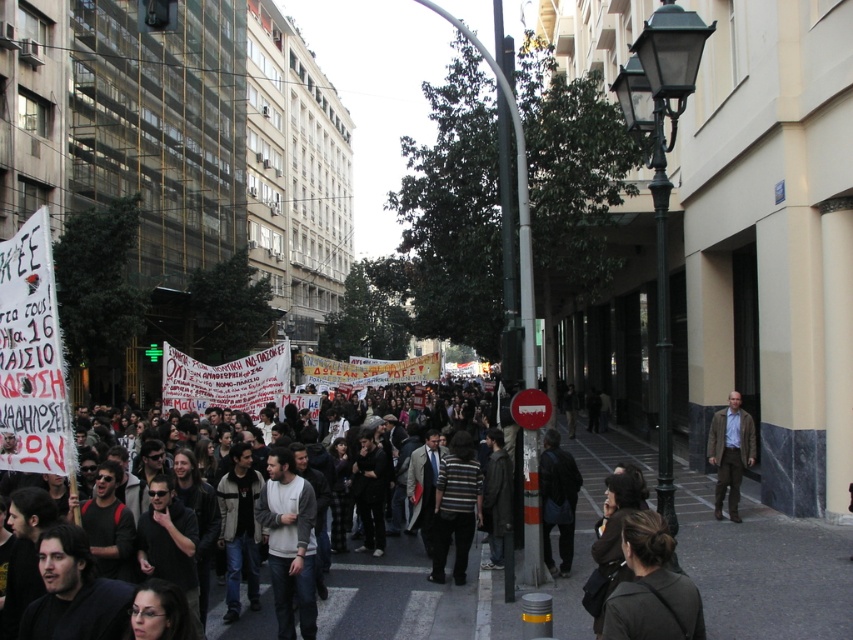
Is dark gray clothing at center taller than gray cotton shirt at center?

Incorrect, dark gray clothing at center's height is not larger of gray cotton shirt at center's.

From the picture: Is dark gray clothing at center bigger than gray cotton shirt at center?

Yes.

Between point (338, 557) and point (283, 604), which one is positioned behind?

Positioned behind is point (338, 557).

Locate an element on the screen. The height and width of the screenshot is (640, 853). dark gray clothing at center is located at coordinates (404, 595).

Is dark gray clothing at center shorter than brown leather jacket at right?

Yes.

Is dark gray clothing at center taller than brown leather jacket at right?

Incorrect, dark gray clothing at center's height is not larger of brown leather jacket at right's.

This screenshot has width=853, height=640. What are the coordinates of `dark gray clothing at center` in the screenshot? It's located at (404, 595).

Between gray cotton shirt at center and brown leather jacket at right, which one has less height?

gray cotton shirt at center is shorter.

Who is more distant from viewer, [282,620] or [730,396]?

The point [730,396] is more distant.

What do you see at coordinates (289, 541) in the screenshot? The image size is (853, 640). I see `gray cotton shirt at center` at bounding box center [289, 541].

Locate an element on the screen. This screenshot has height=640, width=853. gray cotton shirt at center is located at coordinates (289, 541).